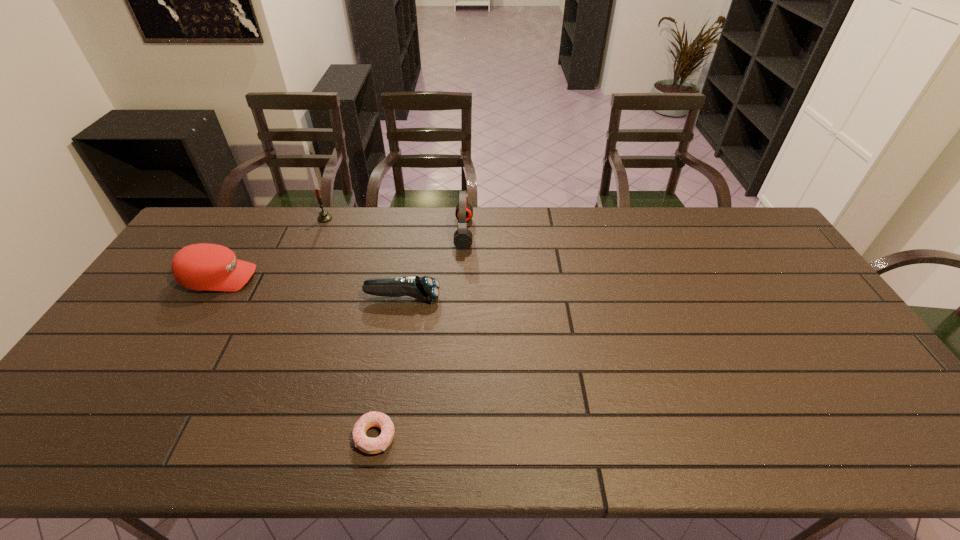
In the image, there is a desktop. Identify the location of blank space at the left edge. (87, 416).

Where is `vacant area between the nearest object and the earphone`? Image resolution: width=960 pixels, height=540 pixels. vacant area between the nearest object and the earphone is located at coordinates (420, 334).

The height and width of the screenshot is (540, 960). In order to click on empty location between the candle and the rightmost object in this screenshot , I will do `click(395, 226)`.

This screenshot has width=960, height=540. In order to click on empty location between the cap and the fourth shortest object in this screenshot , I will do `click(273, 248)`.

Where is `vacant point located between the tallest object and the cap`? The width and height of the screenshot is (960, 540). vacant point located between the tallest object and the cap is located at coordinates (342, 255).

The image size is (960, 540). In order to click on unoccupied position between the candle and the electric shaver in this screenshot , I will do `click(364, 258)`.

Image resolution: width=960 pixels, height=540 pixels. I want to click on free space between the candle and the earphone, so click(395, 226).

At what (x,y) coordinates should I click in order to perform the action: click on free spot between the fourth tallest object and the fourth object from right to left. Please return your answer as a coordinate pair (x, y). Looking at the image, I should click on (364, 258).

This screenshot has width=960, height=540. I want to click on free space that is in between the second object from left to right and the electric shaver, so click(x=364, y=258).

You are a GUI agent. You are given a task and a screenshot of the screen. Output one action in this format:
    pyautogui.click(x=<x>, y=<y>)
    Task: Click on the free area in between the rightmost object and the electric shaver
    The height and width of the screenshot is (540, 960).
    Given the screenshot: What is the action you would take?
    pyautogui.click(x=433, y=265)